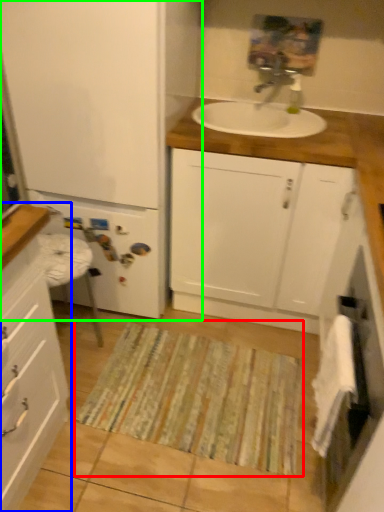
Question: Which object is positioned farthest from doormat (highlighted by a red box)? Select from bathroom cabinet (highlighted by a blue box) and bathroom cabinet (highlighted by a green box).

Choices:
 (A) bathroom cabinet
 (B) bathroom cabinet

Answer: (B)